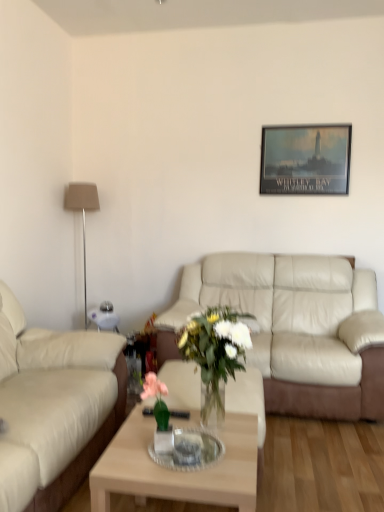
This screenshot has height=512, width=384. Describe the element at coordinates (189, 451) in the screenshot. I see `clear glass tray at center` at that location.

What is the approximate height of beige leather couch at center, marked as the 1th studio couch in a right-to-left arrangement?

It is 3.34 feet.

Locate an element on the screen. The height and width of the screenshot is (512, 384). beige fabric lamp at left is located at coordinates [x=82, y=214].

Describe the element at coordinates (215, 354) in the screenshot. The width and height of the screenshot is (384, 512). I see `white glass vase at center` at that location.

Find the location of `beige leather couch at left, the 1th studio couch from the left`. beige leather couch at left, the 1th studio couch from the left is located at coordinates (55, 406).

At what (x,y) coordinates should I click in order to perform the action: click on clear glass tray at center. Please return your answer as a coordinate pair (x, y). Looking at the image, I should click on (189, 451).

In terms of size, does light wood/transparent glass coffee table at center appear bigger or smaller than white glass vase at center?

light wood/transparent glass coffee table at center is bigger than white glass vase at center.

Is light wood/transparent glass coffee table at center spatially inside white glass vase at center, or outside of it?

light wood/transparent glass coffee table at center is outside white glass vase at center.

Could you tell me if light wood/transparent glass coffee table at center is facing white glass vase at center?

No, light wood/transparent glass coffee table at center is not facing towards white glass vase at center.

Based on their positions, is light wood/transparent glass coffee table at center located to the left or right of white glass vase at center?

In the image, light wood/transparent glass coffee table at center appears on the left side of white glass vase at center.

From the picture: From a real-world perspective, is matte black poster at upper center positioned above or below beige fabric lamp at left?

matte black poster at upper center is situated higher than beige fabric lamp at left in the real world.

Based on the photo, is beige fabric lamp at left located within matte black poster at upper center?

Definitely not — beige fabric lamp at left is not inside matte black poster at upper center.

Is point (320, 147) positioned after point (66, 206)?

No.

Is beige fabric lamp at left further to the viewer compared to beige leather couch at left, which is counted as the second studio couch, starting from the back?

Yes, it is behind beige leather couch at left, which is counted as the second studio couch, starting from the back.

Which object is thinner, beige fabric lamp at left or beige leather couch at left, which appears as the 2th studio couch when viewed from the right?

beige fabric lamp at left.

From the image's perspective, is beige fabric lamp at left beneath beige leather couch at left, which appears as the 2th studio couch when viewed from the right?

Actually, beige fabric lamp at left appears above beige leather couch at left, which appears as the 2th studio couch when viewed from the right, in the image.

Between beige fabric lamp at left and beige leather couch at left, the 1th studio couch from the left, which one appears on the right side from the viewer's perspective?

beige fabric lamp at left.

Who is taller, clear glass tray at center or white glass vase at center?

Standing taller between the two is white glass vase at center.

Is clear glass tray at center not within white glass vase at center?

clear glass tray at center lies outside white glass vase at center's area.

Is clear glass tray at center closer to camera compared to white glass vase at center?

Yes, the depth of clear glass tray at center is less than that of white glass vase at center.

Which is closer to the camera, (240, 342) or (255, 479)?

The point (255, 479) is closer.

The height and width of the screenshot is (512, 384). What are the coordinates of `houseplant located above the light wood/transparent glass coffee table at center (from a real-world perspective)` in the screenshot? It's located at (215, 354).

From a real-world perspective, is white glass vase at center physically below light wood/transparent glass coffee table at center?

No.

Considering the sizes of objects white glass vase at center and light wood/transparent glass coffee table at center in the image provided, who is bigger, white glass vase at center or light wood/transparent glass coffee table at center?

With larger size is light wood/transparent glass coffee table at center.

How different are the orientations of beige fabric lamp at left and light wood/transparent glass coffee table at center in degrees?

They differ by 0.745 degrees in their facing directions.

In the image, is beige fabric lamp at left positioned in front of or behind light wood/transparent glass coffee table at center?

beige fabric lamp at left is positioned farther from the viewer than light wood/transparent glass coffee table at center.

Can light wood/transparent glass coffee table at center be found inside beige fabric lamp at left?

Definitely not — light wood/transparent glass coffee table at center is not inside beige fabric lamp at left.

Which of these two, beige leather couch at left, which is counted as the first studio couch, starting from the front, or light wood/transparent glass coffee table at center, stands taller?

beige leather couch at left, which is counted as the first studio couch, starting from the front.

Is beige leather couch at left, which is counted as the second studio couch, starting from the back, directly adjacent to light wood/transparent glass coffee table at center?

beige leather couch at left, which is counted as the second studio couch, starting from the back, and light wood/transparent glass coffee table at center are clearly separated.

From the image's perspective, between beige leather couch at left, the 1th studio couch from the left, and light wood/transparent glass coffee table at center, which one is located above?

beige leather couch at left, the 1th studio couch from the left, appears higher in the image.

Is beige leather couch at left, which appears as the 2th studio couch when viewed from the right, aimed at light wood/transparent glass coffee table at center?

Yes, beige leather couch at left, which appears as the 2th studio couch when viewed from the right, faces towards light wood/transparent glass coffee table at center.

Identify the location of coffee table below the white glass vase at center (from a real-world perspective). This screenshot has width=384, height=512. (177, 471).

In order to click on lamp that is below the matte black poster at upper center (from the image's perspective) in this screenshot , I will do `click(82, 214)`.

Considering their positions, is matte black poster at upper center positioned closer to beige fabric lamp at left than beige leather couch at center, which is counted as the first studio couch, starting from the back?

matte black poster at upper center.

Looking at the image, which one is located closer to beige leather couch at left, which is counted as the second studio couch, starting from the back, white glass vase at center or beige fabric lamp at left?

The object closer to beige leather couch at left, which is counted as the second studio couch, starting from the back, is white glass vase at center.

Looking at the image, which one is located closer to white glass vase at center, beige leather couch at center, marked as the 1th studio couch in a right-to-left arrangement, or clear glass tray at center?

Among the two, clear glass tray at center is located nearer to white glass vase at center.

Based on their spatial positions, is white glass vase at center or beige leather couch at center, which is counted as the first studio couch, starting from the back, closer to clear glass tray at center?

white glass vase at center.

From the picture: When comparing their distances from clear glass tray at center, does beige leather couch at center, placed as the second studio couch when sorted from front to back, or white glass vase at center seem closer?

Based on the image, white glass vase at center appears to be nearer to clear glass tray at center.

Looking at the image, which one is located closer to light wood/transparent glass coffee table at center, beige leather couch at left, which appears as the 2th studio couch when viewed from the right, or matte black poster at upper center?

beige leather couch at left, which appears as the 2th studio couch when viewed from the right, is positioned closer to the anchor light wood/transparent glass coffee table at center.

Estimate the real-world distances between objects in this image. Which object is closer to matte black poster at upper center, beige leather couch at center, the second studio couch viewed from the left, or light wood/transparent glass coffee table at center?

The object closer to matte black poster at upper center is beige leather couch at center, the second studio couch viewed from the left.

Estimate the real-world distances between objects in this image. Which object is further from light wood/transparent glass coffee table at center, beige leather couch at left, which is counted as the first studio couch, starting from the front, or beige fabric lamp at left?

The object further to light wood/transparent glass coffee table at center is beige fabric lamp at left.

Identify the location of coffee table positioned between beige leather couch at left, the 1th studio couch from the left, and beige fabric lamp at left from near to far. (177, 471).

In order to click on houseplant between clear glass tray at center and matte black poster at upper center from front to back in this screenshot , I will do `click(215, 354)`.

You are a GUI agent. You are given a task and a screenshot of the screen. Output one action in this format:
    pyautogui.click(x=<x>, y=<y>)
    Task: Click on the glass table between beige leather couch at left, the 1th studio couch from the left, and beige leather couch at center, the second studio couch viewed from the left, in the horizontal direction
    
    Given the screenshot: What is the action you would take?
    pyautogui.click(x=189, y=451)

Locate an element on the screen. Image resolution: width=384 pixels, height=512 pixels. glass table between beige leather couch at left, which is counted as the second studio couch, starting from the back, and matte black poster at upper center, along the z-axis is located at coordinates (189, 451).